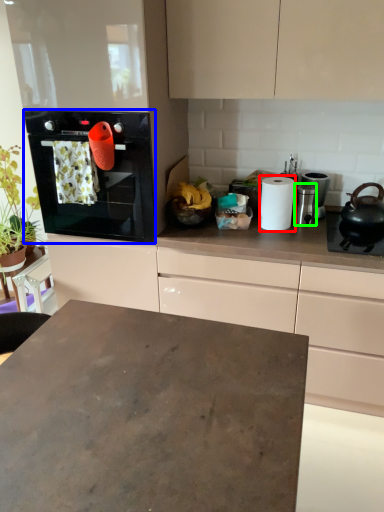
Question: Which object is positioned closest to paper towel (highlighted by a red box)? Select from home appliance (highlighted by a blue box) and appliance (highlighted by a green box).

Choices:
 (A) home appliance
 (B) appliance

Answer: (B)